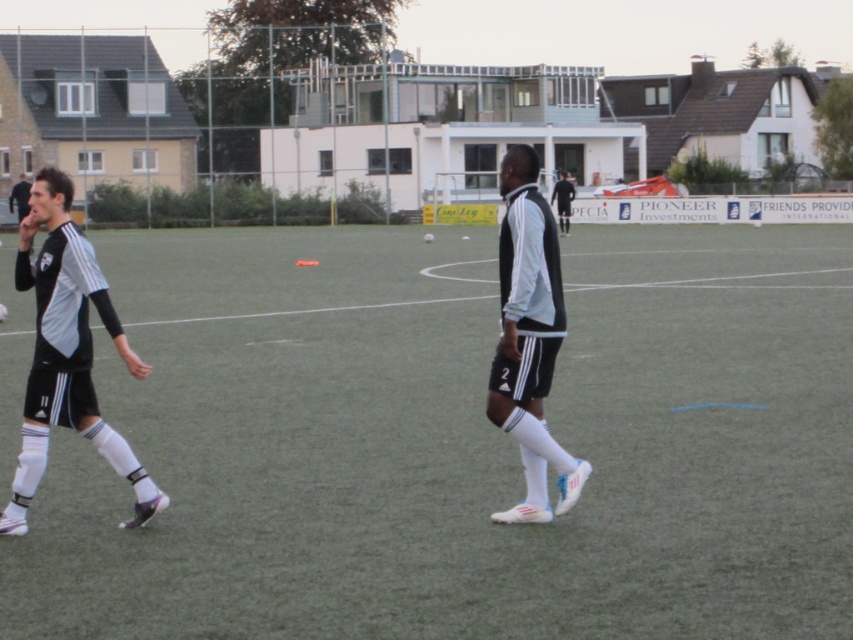
Between black matte jersey at left and black jersey at center, which one has more height?

Standing taller between the two is black jersey at center.

Is point (123, 342) closer to viewer compared to point (561, 211)?

Yes, it is in front of point (561, 211).

This screenshot has height=640, width=853. In order to click on black matte jersey at left in this screenshot , I will do `click(67, 353)`.

Which is more to the right, green artificial turf at center or black matte jersey at left?

green artificial turf at center is more to the right.

Is green artificial turf at center positioned before black matte jersey at left?

Yes, it is.

Who is more distant from viewer, (170, 582) or (120, 333)?

Point (120, 333)

Identify the location of green artificial turf at center. pos(457,442).

Between white adidas socks at center and black jersey at left, which one appears on the right side from the viewer's perspective?

white adidas socks at center is more to the right.

Where is `white adidas socks at center`? The width and height of the screenshot is (853, 640). white adidas socks at center is located at coordinates (529, 339).

Find the location of `white adidas socks at center`. white adidas socks at center is located at coordinates (529, 339).